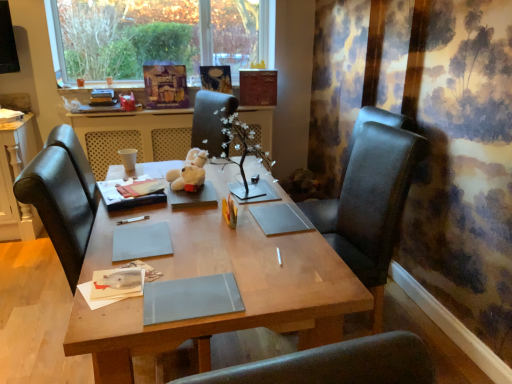
The image size is (512, 384). Describe the element at coordinates (190, 298) in the screenshot. I see `matte gray notebook at center, which is counted as the first notebook, starting from the bottom` at that location.

Describe the element at coordinates (189, 171) in the screenshot. The image size is (512, 384). I see `white plush bear at center` at that location.

Locate an element on the screen. Image resolution: width=512 pixels, height=384 pixels. white plush bear at center is located at coordinates (189, 171).

At what (x,y) coordinates should I click in order to perform the action: click on wooden table at center. Please return your answer as a coordinate pair (x, y). This screenshot has height=384, width=512. Looking at the image, I should click on (133, 136).

Find the location of a particular element. The width and height of the screenshot is (512, 384). wooden desk at center is located at coordinates (211, 274).

Can you confirm if wooden desk at center is shorter than matte gray notebook at center, placed as the first notebook when sorted from front to back?

Incorrect, the height of wooden desk at center does not fall short of that of matte gray notebook at center, placed as the first notebook when sorted from front to back.

Is wooden desk at center not inside matte gray notebook at center, which is the 1th notebook in right-to-left order?

Absolutely, wooden desk at center is external to matte gray notebook at center, which is the 1th notebook in right-to-left order.

From the image's perspective, which one is positioned higher, wooden desk at center or matte gray notebook at center, which is the 1th notebook in right-to-left order?

matte gray notebook at center, which is the 1th notebook in right-to-left order, is shown above in the image.

Can you confirm if white plush bear at center is shorter than wooden desk at center?

Correct, white plush bear at center is not as tall as wooden desk at center.

Is white plush bear at center to the right of wooden desk at center from the viewer's perspective?

No.

In the image, is white plush bear at center positioned in front of or behind wooden desk at center?

In the image, white plush bear at center appears behind wooden desk at center.

Does wooden desk at center turn towards white plush bear at center?

No.

Does point (135, 356) lie behind point (194, 176)?

No.

From the picture: Based on their sizes in the image, would you say wooden desk at center is bigger or smaller than white plush bear at center?

wooden desk at center is bigger than white plush bear at center.

Is wooden desk at center at the left side of matte paper book at center?

Incorrect, wooden desk at center is not on the left side of matte paper book at center.

Based on the photo, could you tell me if wooden desk at center is facing matte paper book at center?

No, wooden desk at center is not oriented towards matte paper book at center.

Does point (287, 199) come in front of point (114, 193)?

No, it is behind (114, 193).

Based on the photo, does black leather chair at right turn towards matte gray notebook at center, placed as the first notebook when sorted from front to back?

No.

Does point (371, 279) come farther from viewer compared to point (207, 291)?

That is True.

Is black leather chair at right smaller than matte gray notebook at center, the 2th notebook positioned from the back?

Actually, black leather chair at right might be larger than matte gray notebook at center, the 2th notebook positioned from the back.

From the picture: From the image's perspective, is black leather chair at right located above matte gray notebook at center, positioned as the second notebook in left-to-right order?

Indeed, from the image's perspective, black leather chair at right is shown above matte gray notebook at center, positioned as the second notebook in left-to-right order.

This screenshot has height=384, width=512. What are the coordinates of `desk that appears in front of the wooden table at center` in the screenshot? It's located at (211, 274).

From the image's perspective, is wooden desk at center beneath wooden table at center?

Yes, from the image's perspective, wooden desk at center is below wooden table at center.

Is point (192, 213) closer or farther from the camera than point (126, 131)?

Point (192, 213) is closer to the camera than point (126, 131).

Considering the sizes of objects matte gray notebook at center, positioned as the second notebook in left-to-right order, and wooden table at center in the image provided, who is smaller, matte gray notebook at center, positioned as the second notebook in left-to-right order, or wooden table at center?

matte gray notebook at center, positioned as the second notebook in left-to-right order.

From the picture: Is matte gray notebook at center, which is the 1th notebook in right-to-left order, aimed at wooden table at center?

Yes, matte gray notebook at center, which is the 1th notebook in right-to-left order, is oriented towards wooden table at center.

Does matte gray notebook at center, placed as the first notebook when sorted from front to back, lie behind wooden table at center?

No, matte gray notebook at center, placed as the first notebook when sorted from front to back, is closer to the camera.

Which is less distant, (234, 297) or (109, 119)?

The point (234, 297) is more forward.

What are the coordinates of `notebook on the right of the wooden desk at center` in the screenshot? It's located at (190, 298).

You are a GUI agent. You are given a task and a screenshot of the screen. Output one action in this format:
    pyautogui.click(x=<x>, y=<y>)
    Task: Click on the desk in front of the white plush bear at center
    This screenshot has height=384, width=512.
    Given the screenshot: What is the action you would take?
    pyautogui.click(x=211, y=274)

Which object lies further to the anchor point matte gray notebook at center, which is the 1th notebook in right-to-left order, gray matte notebook at center, the 1th notebook when ordered from left to right, or wooden desk at center?

gray matte notebook at center, the 1th notebook when ordered from left to right, is further to matte gray notebook at center, which is the 1th notebook in right-to-left order.

Considering their positions, is matte paper book at center positioned further to matte gray notebook at center, which is counted as the 2th notebook, starting from the top, than black leather chair at right?

The object further to matte gray notebook at center, which is counted as the 2th notebook, starting from the top, is black leather chair at right.

Based on their spatial positions, is matte gray notebook at center, placed as the first notebook when sorted from front to back, or matte paper book at center further from white plush bear at center?

matte gray notebook at center, placed as the first notebook when sorted from front to back, is further to white plush bear at center.

Considering their positions, is matte paper book at center positioned further to matte gray notebook at center, which is counted as the first notebook, starting from the bottom, than wooden table at center?

wooden table at center is positioned further to the anchor matte gray notebook at center, which is counted as the first notebook, starting from the bottom.

When comparing their distances from wooden table at center, does gray matte notebook at center, which is the 2th notebook from right to left, or wooden desk at center seem closer?

wooden desk at center is positioned closer to the anchor wooden table at center.

From the image, which object appears to be nearer to wooden desk at center, black leather chair at right or matte gray notebook at center, positioned as the second notebook in left-to-right order?

Based on the image, matte gray notebook at center, positioned as the second notebook in left-to-right order, appears to be nearer to wooden desk at center.

Estimate the real-world distances between objects in this image. Which object is closer to gray matte notebook at center, which is the 2th notebook from right to left, matte paper book at center or white plush bear at center?

The object closer to gray matte notebook at center, which is the 2th notebook from right to left, is matte paper book at center.

Which object lies nearer to the anchor point gray matte notebook at center, the 1th notebook when ordered from left to right, white plush bear at center or wooden desk at center?

The object closer to gray matte notebook at center, the 1th notebook when ordered from left to right, is wooden desk at center.

Find the location of a particular element. The image size is (512, 384). notebook between gray matte notebook at center, the 1th notebook from the top, and black leather chair at right, in the horizontal direction is located at coordinates (190, 298).

Where is `desk located between gray matte notebook at center, the 1th notebook from the top, and black leather chair at right in the left-right direction`? The width and height of the screenshot is (512, 384). desk located between gray matte notebook at center, the 1th notebook from the top, and black leather chair at right in the left-right direction is located at coordinates (211, 274).

You are a GUI agent. You are given a task and a screenshot of the screen. Output one action in this format:
    pyautogui.click(x=<x>, y=<y>)
    Task: Click on the toy located between matte paper book at center and black leather chair at right in the left-right direction
    Image resolution: width=512 pixels, height=384 pixels.
    Given the screenshot: What is the action you would take?
    (189, 171)

In order to click on notebook between wooden desk at center and black leather chair at right in the horizontal direction in this screenshot , I will do `click(190, 298)`.